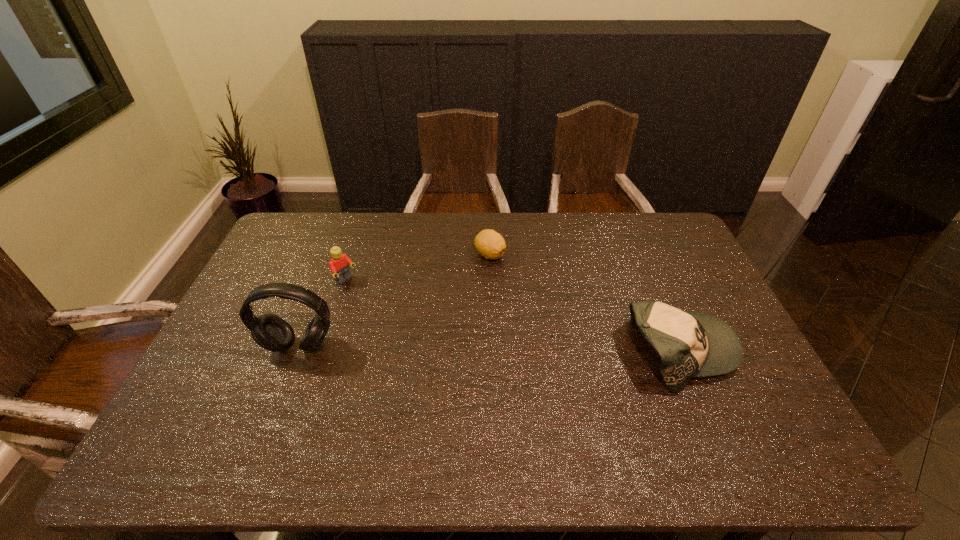
This screenshot has height=540, width=960. In order to click on the tallest object in this screenshot , I will do `click(271, 332)`.

Image resolution: width=960 pixels, height=540 pixels. What are the coordinates of `the rightmost object` in the screenshot? It's located at (690, 344).

The height and width of the screenshot is (540, 960). Find the location of `the shortest object`. the shortest object is located at coordinates (490, 244).

Locate an element on the screen. This screenshot has width=960, height=540. the third object from left to right is located at coordinates (490, 244).

You are a GUI agent. You are given a task and a screenshot of the screen. Output one action in this format:
    pyautogui.click(x=<x>, y=<y>)
    Task: Click on the second farthest object
    This screenshot has height=540, width=960.
    Given the screenshot: What is the action you would take?
    pyautogui.click(x=339, y=262)

Image resolution: width=960 pixels, height=540 pixels. I want to click on free spot located 0.080m on the earcups of the headset, so click(284, 383).

Where is `vacant area situated 0.200m at the stem end of the second object from right to left`? vacant area situated 0.200m at the stem end of the second object from right to left is located at coordinates [x=516, y=306].

Where is `vacant space located 0.060m at the stem end of the second object from right to left`? The height and width of the screenshot is (540, 960). vacant space located 0.060m at the stem end of the second object from right to left is located at coordinates (501, 277).

You are a GUI agent. You are given a task and a screenshot of the screen. Output one action in this format:
    pyautogui.click(x=<x>, y=<y>)
    Task: Click on the vacant position located at the stem end of the second object from right to left
    The image size is (960, 540).
    Given the screenshot: What is the action you would take?
    pyautogui.click(x=509, y=293)

Identify the location of vacant space located on the face of the Lego. The height and width of the screenshot is (540, 960). (413, 329).